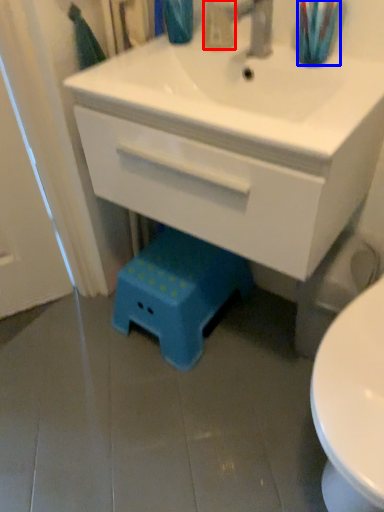
Question: Which object is closer to the camera taking this photo, toiletry (highlighted by a red box) or toothbrush (highlighted by a blue box)?

Choices:
 (A) toiletry
 (B) toothbrush

Answer: (B)